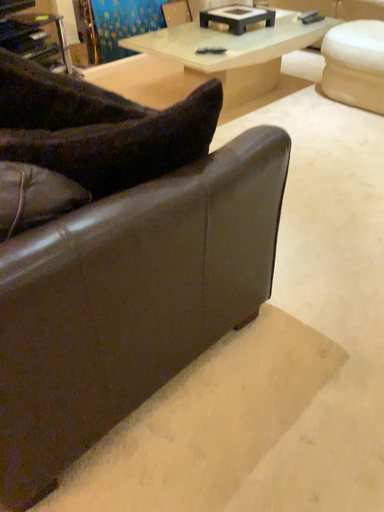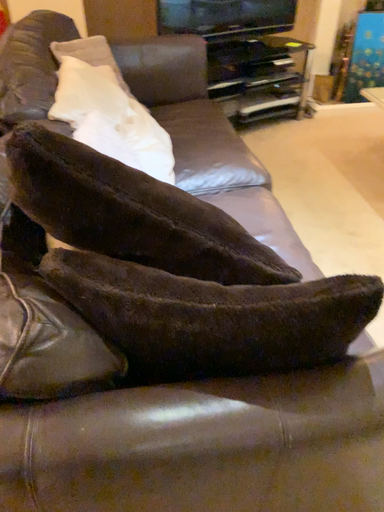
Question: How did the camera likely rotate when shooting the video?

Choices:
 (A) rotated right
 (B) rotated left

Answer: (B)